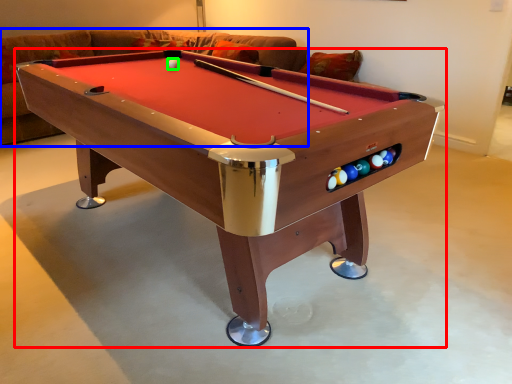
Question: Based on their relative distances, which object is nearer to billiard table (highlighted by a red box)? Choose from couch (highlighted by a blue box) and ball (highlighted by a green box).

Choices:
 (A) couch
 (B) ball

Answer: (B)